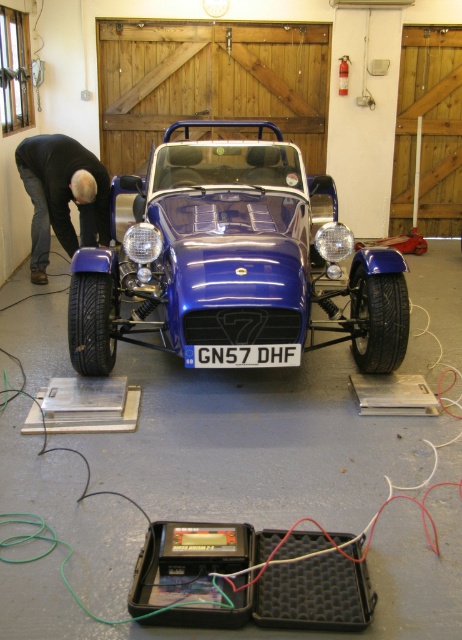
Question: Does glossy blue car at center come in front of dark blue jeans at left?

Choices:
 (A) no
 (B) yes

Answer: (B)

Question: Is dark blue jeans at left above black plastic license plate at center?

Choices:
 (A) no
 (B) yes

Answer: (B)

Question: Can you confirm if glossy blue car at center is smaller than black plastic license plate at center?

Choices:
 (A) no
 (B) yes

Answer: (A)

Question: Which point is farther from the camera taking this photo?

Choices:
 (A) (138, 266)
 (B) (261, 346)
 (C) (91, 179)

Answer: (C)

Question: Which of the following is the closest to the observer?

Choices:
 (A) (237, 336)
 (B) (103, 166)

Answer: (A)

Question: Estimate the real-world distances between objects in this image. Which object is farther from the dark blue jeans at left?

Choices:
 (A) black plastic license plate at center
 (B) glossy blue car at center

Answer: (A)